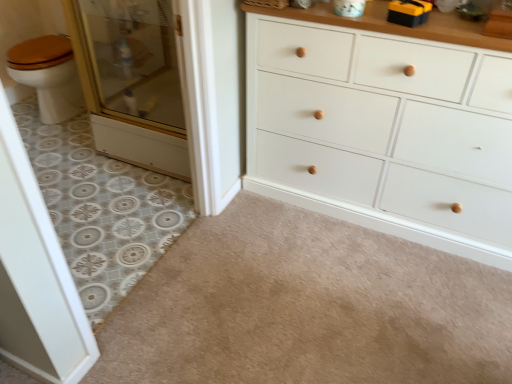
Locate an element on the screen. This screenshot has width=512, height=384. black plastic tool at upper right is located at coordinates (408, 12).

You are a GUI agent. You are given a task and a screenshot of the screen. Output one action in this format:
    pyautogui.click(x=<x>, y=<y>)
    Task: Click on the patterned tile floor at left, arranged as the second plain when viewed from the right
    This screenshot has height=384, width=512.
    Given the screenshot: What is the action you would take?
    pyautogui.click(x=102, y=208)

Which point is more distant from viewer, (306, 319) or (404, 11)?

Point (306, 319)

From the image's perspective, does beige carpet at lower center, positioned as the second plain in left-to-right order, appear higher than black plastic tool at upper right?

Incorrect, from the image's perspective, beige carpet at lower center, positioned as the second plain in left-to-right order, is lower than black plastic tool at upper right.

Is beige carpet at lower center, positioned as the second plain in left-to-right order, far from black plastic tool at upper right?

Absolutely, beige carpet at lower center, positioned as the second plain in left-to-right order, is distant from black plastic tool at upper right.

Does beige carpet at lower center, positioned as the second plain in left-to-right order, appear on the right side of black plastic tool at upper right?

Incorrect, beige carpet at lower center, positioned as the second plain in left-to-right order, is not on the right side of black plastic tool at upper right.

Is black plastic tool at upper right looking in the opposite direction of beige carpet at lower center, positioned as the first plain in right-to-left order?

No, black plastic tool at upper right is not facing the opposite direction of beige carpet at lower center, positioned as the first plain in right-to-left order.

Based on the photo, from the image's perspective, which is above, black plastic tool at upper right or beige carpet at lower center, positioned as the first plain in right-to-left order?

From the image's view, black plastic tool at upper right is above.

Considering the sizes of objects black plastic tool at upper right and beige carpet at lower center, positioned as the first plain in right-to-left order, in the image provided, who is smaller, black plastic tool at upper right or beige carpet at lower center, positioned as the first plain in right-to-left order,?

Smaller between the two is black plastic tool at upper right.

Are patterned tile floor at left, arranged as the second plain when viewed from the right, and beige carpet at lower center, positioned as the second plain in left-to-right order, located far from each other?

No, patterned tile floor at left, arranged as the second plain when viewed from the right, is not far away from beige carpet at lower center, positioned as the second plain in left-to-right order.

Could you tell me if patterned tile floor at left, the first plain positioned from the left, is facing beige carpet at lower center, positioned as the second plain in left-to-right order?

Yes, patterned tile floor at left, the first plain positioned from the left, is aimed at beige carpet at lower center, positioned as the second plain in left-to-right order.

Choose the correct answer: Is patterned tile floor at left, the first plain positioned from the left, inside beige carpet at lower center, positioned as the first plain in right-to-left order, or outside it?

patterned tile floor at left, the first plain positioned from the left, is not inside beige carpet at lower center, positioned as the first plain in right-to-left order, it's outside.

From a real-world perspective, which is physically above, clear glass screen door at left, marked as the 2th screen door in a top-to-bottom arrangement, or black plastic tool at upper right?

From a 3D spatial view, black plastic tool at upper right is above.

From the image's perspective, is clear glass screen door at left, which is counted as the first screen door, starting from the bottom, located above or below black plastic tool at upper right?

From the image's perspective, clear glass screen door at left, which is counted as the first screen door, starting from the bottom, appears below black plastic tool at upper right.

This screenshot has height=384, width=512. What are the coordinates of `screen door in front of the black plastic tool at upper right` in the screenshot? It's located at tap(36, 276).

Are clear glass screen door at left, acting as the 2th screen door starting from the back, and black plastic tool at upper right far apart?

Yes, clear glass screen door at left, acting as the 2th screen door starting from the back, and black plastic tool at upper right are located far from each other.

In terms of size, does patterned tile floor at left, the first plain positioned from the left, appear bigger or smaller than clear glass screen door at left, which is the 1th screen door in front-to-back order?

patterned tile floor at left, the first plain positioned from the left, is bigger than clear glass screen door at left, which is the 1th screen door in front-to-back order.

Between patterned tile floor at left, the first plain positioned from the left, and clear glass screen door at left, which is counted as the first screen door, starting from the bottom, which one appears on the right side from the viewer's perspective?

clear glass screen door at left, which is counted as the first screen door, starting from the bottom, is more to the right.

Is the depth of patterned tile floor at left, arranged as the second plain when viewed from the right, greater than that of clear glass screen door at left, marked as the 2th screen door in a top-to-bottom arrangement?

Yes, patterned tile floor at left, arranged as the second plain when viewed from the right, is further from the viewer.

Looking at their sizes, would you say patterned tile floor at left, arranged as the second plain when viewed from the right, is wider or thinner than black plastic tool at upper right?

In the image, patterned tile floor at left, arranged as the second plain when viewed from the right, appears to be wider than black plastic tool at upper right.

Is patterned tile floor at left, arranged as the second plain when viewed from the right, smaller than black plastic tool at upper right?

Incorrect, patterned tile floor at left, arranged as the second plain when viewed from the right, is not smaller in size than black plastic tool at upper right.

Is patterned tile floor at left, arranged as the second plain when viewed from the right, at the left side of black plastic tool at upper right?

Yes, patterned tile floor at left, arranged as the second plain when viewed from the right, is to the left of black plastic tool at upper right.

Based on the photo, is white painted wood chest of drawers at center to the left of clear glass screen door at left, the first screen door positioned from the back, from the viewer's perspective?

Result: No, white painted wood chest of drawers at center is not to the left of clear glass screen door at left, the first screen door positioned from the back.

Based on the photo, are white painted wood chest of drawers at center and clear glass screen door at left, the 2th screen door when ordered from bottom to top, located far from each other?

No, white painted wood chest of drawers at center is not far from clear glass screen door at left, the 2th screen door when ordered from bottom to top.

Does white painted wood chest of drawers at center turn towards clear glass screen door at left, the 2th screen door when ordered from bottom to top?

No, white painted wood chest of drawers at center does not turn towards clear glass screen door at left, the 2th screen door when ordered from bottom to top.

Between point (301, 37) and point (178, 102), which one is positioned in front?

The point (301, 37) is more forward.

Find the location of a particular element. This screenshot has height=384, width=512. toy above the beige carpet at lower center, positioned as the second plain in left-to-right order (from the image's perspective) is located at coordinates click(408, 12).

The height and width of the screenshot is (384, 512). What are the coordinates of `toy on the right of beige carpet at lower center, positioned as the second plain in left-to-right order` in the screenshot? It's located at (408, 12).

From the picture: Estimate the real-world distances between objects in this image. Which object is closer to white painted wood chest of drawers at center, patterned tile floor at left, the first plain positioned from the left, or beige carpet at lower center, positioned as the first plain in right-to-left order?

Based on the image, beige carpet at lower center, positioned as the first plain in right-to-left order, appears to be nearer to white painted wood chest of drawers at center.

Which object lies further to the anchor point patterned tile floor at left, arranged as the second plain when viewed from the right, white painted wood chest of drawers at center or black plastic tool at upper right?

Among the two, black plastic tool at upper right is located further to patterned tile floor at left, arranged as the second plain when viewed from the right.

Looking at the image, which one is located further to clear glass screen door at left, the first screen door positioned from the back, patterned tile floor at left, the first plain positioned from the left, or beige carpet at lower center, positioned as the first plain in right-to-left order?

beige carpet at lower center, positioned as the first plain in right-to-left order.

Looking at the image, which one is located further to patterned tile floor at left, the first plain positioned from the left, black plastic tool at upper right or beige carpet at lower center, positioned as the first plain in right-to-left order?

black plastic tool at upper right is positioned further to the anchor patterned tile floor at left, the first plain positioned from the left.

Considering their positions, is beige carpet at lower center, positioned as the first plain in right-to-left order, positioned closer to clear glass screen door at left, the first screen door positioned from the back, than clear glass screen door at left, acting as the 2th screen door starting from the back?

Based on the image, beige carpet at lower center, positioned as the first plain in right-to-left order, appears to be nearer to clear glass screen door at left, the first screen door positioned from the back.

Looking at this image, which object lies further to the anchor point white painted wood chest of drawers at center, clear glass screen door at left, acting as the 2th screen door starting from the back, or clear glass screen door at left, the first screen door positioned from the back?

The object further to white painted wood chest of drawers at center is clear glass screen door at left, acting as the 2th screen door starting from the back.

When comparing their distances from clear glass screen door at left, marked as the 1th screen door in a top-to-bottom arrangement, does patterned tile floor at left, arranged as the second plain when viewed from the right, or white painted wood chest of drawers at center seem closer?

patterned tile floor at left, arranged as the second plain when viewed from the right, is positioned closer to the anchor clear glass screen door at left, marked as the 1th screen door in a top-to-bottom arrangement.

Estimate the real-world distances between objects in this image. Which object is closer to black plastic tool at upper right, clear glass screen door at left, marked as the 1th screen door in a top-to-bottom arrangement, or beige carpet at lower center, positioned as the first plain in right-to-left order?

beige carpet at lower center, positioned as the first plain in right-to-left order, is closer to black plastic tool at upper right.

The height and width of the screenshot is (384, 512). Identify the location of plain between patterned tile floor at left, arranged as the second plain when viewed from the right, and white painted wood chest of drawers at center. (306, 307).

This screenshot has width=512, height=384. Find the location of `chest of drawers between black plastic tool at upper right and beige carpet at lower center, positioned as the first plain in right-to-left order, from top to bottom`. chest of drawers between black plastic tool at upper right and beige carpet at lower center, positioned as the first plain in right-to-left order, from top to bottom is located at coordinates (383, 133).

Identify the location of plain between clear glass screen door at left, marked as the 2th screen door in a top-to-bottom arrangement, and white painted wood chest of drawers at center from left to right. This screenshot has width=512, height=384. (306, 307).

Locate an element on the screen. This screenshot has height=384, width=512. toy situated between clear glass screen door at left, the first screen door positioned from the back, and white painted wood chest of drawers at center from left to right is located at coordinates (408, 12).